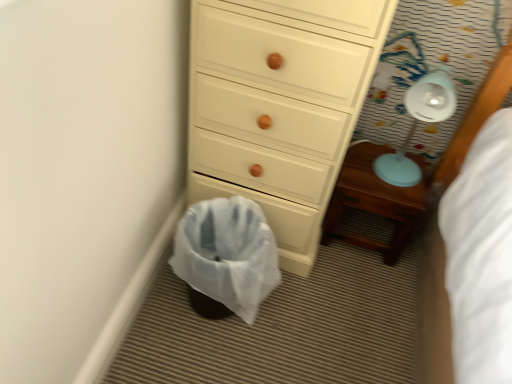
This screenshot has height=384, width=512. I want to click on free space behind white plastic lamp at upper right, so 386,150.